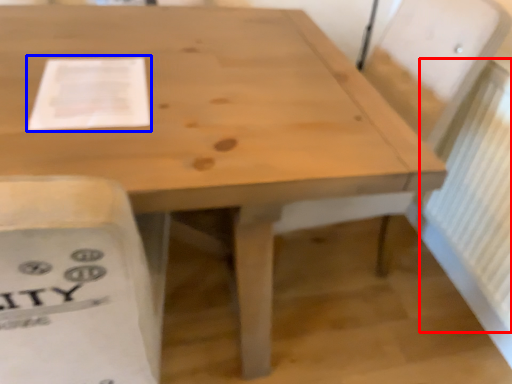
Question: Which of the following is the farthest to the observer, radiator (highlighted by a red box) or paper (highlighted by a blue box)?

Choices:
 (A) radiator
 (B) paper

Answer: (A)